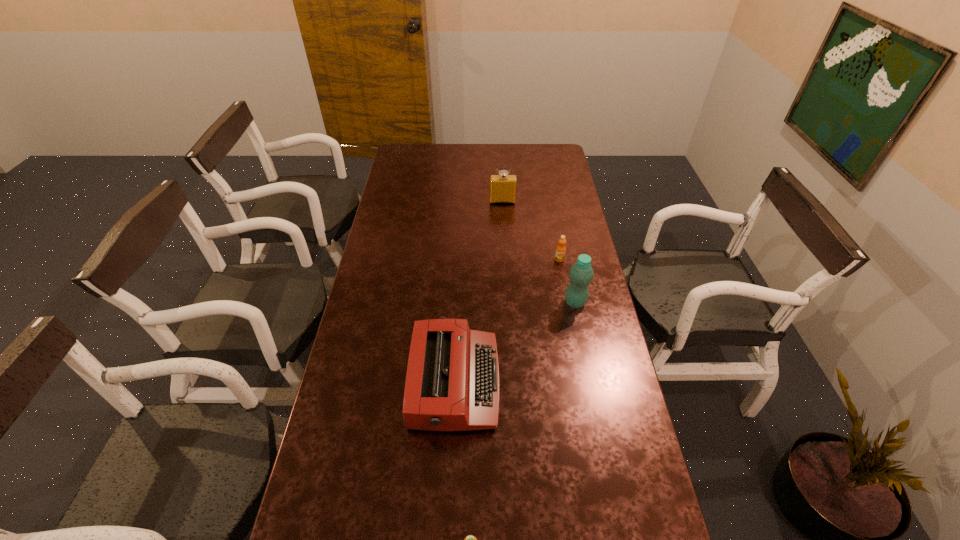
At what (x,y) coordinates should I click in order to perform the action: click on vacant area located 0.060m on the front-facing side of the fourth shortest object. Please return your answer as a coordinate pair (x, y). This screenshot has height=540, width=960. Looking at the image, I should click on (x=503, y=213).

Find the location of `free space located 0.400m on the front label of the right orange juice`. free space located 0.400m on the front label of the right orange juice is located at coordinates (576, 348).

Image resolution: width=960 pixels, height=540 pixels. I want to click on free space located on the typing side of the second nearest object, so click(x=583, y=382).

Locate an element on the screen. The width and height of the screenshot is (960, 540). water bottle at the right edge is located at coordinates (581, 273).

Identify the location of orange juice that is at the right edge. (561, 249).

This screenshot has height=540, width=960. In the image, there is a desktop. Find the location of `vacant space at the far edge`. vacant space at the far edge is located at coordinates (490, 145).

In the image, there is a desktop. What are the coordinates of `vacant space at the left edge` in the screenshot? It's located at (323, 446).

Image resolution: width=960 pixels, height=540 pixels. Identify the location of blank space at the right edge. (599, 442).

Identify the location of vacant space at the far right corner of the desktop. The height and width of the screenshot is (540, 960). (555, 160).

In order to click on free spot between the water bottle and the right orange juice in this screenshot , I will do `click(567, 281)`.